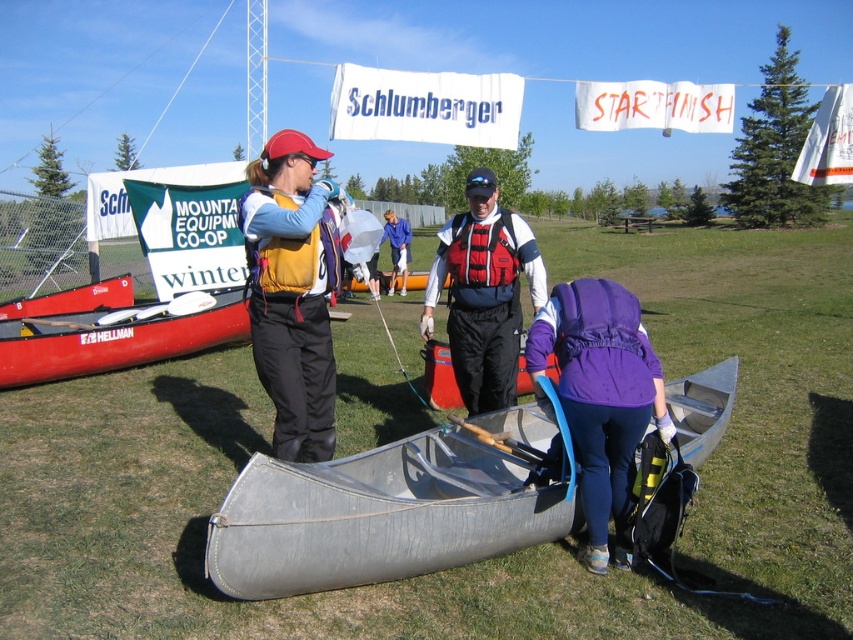
Who is more distant from viewer, (x=434, y=490) or (x=392, y=224)?

The point (x=392, y=224) is behind.

Who is more distant from viewer, (372, 545) or (387, 225)?

Point (387, 225)

At what (x,y) coordinates should I click in order to perform the action: click on gray rubber canoe at center. Please return your answer as a coordinate pair (x, y). Looking at the image, I should click on (378, 516).

Who is positioned more to the left, matte yellow life vest at center or red mesh life jacket at center?

Positioned to the left is matte yellow life vest at center.

Which of these two, matte yellow life vest at center or red mesh life jacket at center, stands taller?

With more height is red mesh life jacket at center.

Based on the photo, who is more distant from viewer, (306,275) or (506,241)?

Positioned behind is point (506,241).

What are the coordinates of `matte yellow life vest at center` in the screenshot? It's located at (292, 291).

Does matte yellow life vest at center lie behind metallic gray canoe at center?

No, matte yellow life vest at center is closer to the viewer.

Does matte yellow life vest at center appear on the right side of metallic gray canoe at center?

Incorrect, matte yellow life vest at center is not on the right side of metallic gray canoe at center.

Which is behind, point (256, 314) or point (521, 342)?

The point (521, 342) is more distant.

Locate an element on the screen. matte yellow life vest at center is located at coordinates (292, 291).